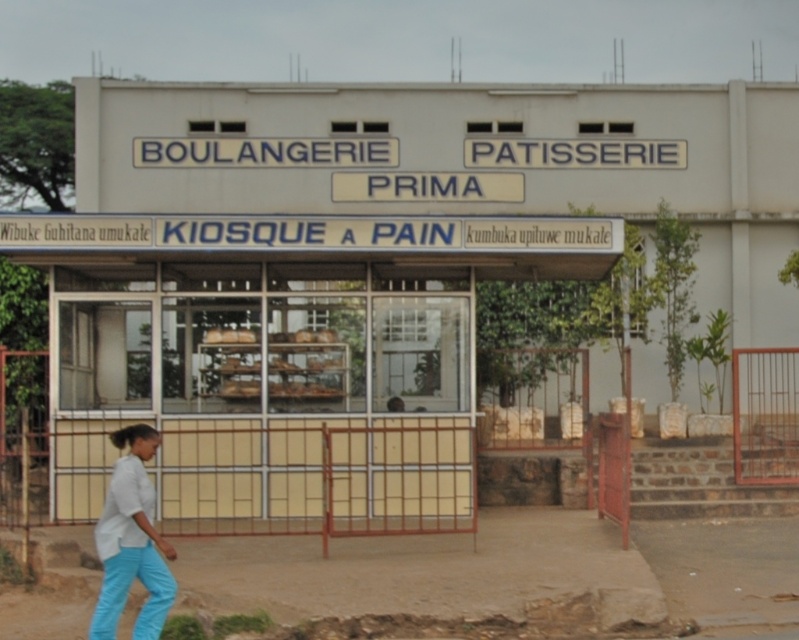
From the picture: Is matte yellow kiosk at center below white fabric pants at lower left?

Incorrect, matte yellow kiosk at center is not positioned below white fabric pants at lower left.

Which is above, matte yellow kiosk at center or white fabric pants at lower left?

matte yellow kiosk at center is higher up.

Between point (562, 248) and point (98, 557), which one is positioned behind?

The point (562, 248) is more distant.

You are a GUI agent. You are given a task and a screenshot of the screen. Output one action in this format:
    pyautogui.click(x=<x>, y=<y>)
    Task: Click on the matte yellow kiosk at center
    The image size is (799, 640).
    Given the screenshot: What is the action you would take?
    pyautogui.click(x=281, y=371)